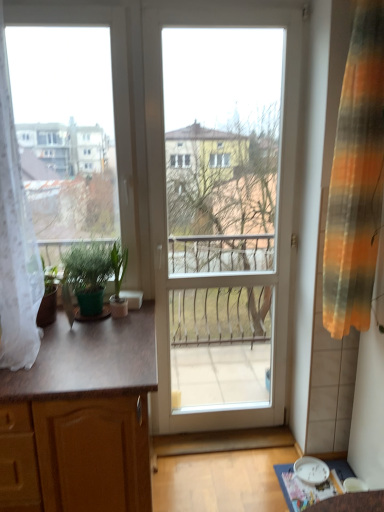
Question: Can you confirm if wooden cabinet at left is taller than green matte plant at left, positioned as the second houseplant in left-to-right order?

Choices:
 (A) no
 (B) yes

Answer: (B)

Question: From the image's perspective, does wooden cabinet at left appear higher than green matte plant at left, positioned as the second houseplant in left-to-right order?

Choices:
 (A) no
 (B) yes

Answer: (A)

Question: Does wooden cabinet at left appear on the left side of green matte plant at left, positioned as the second houseplant in left-to-right order?

Choices:
 (A) yes
 (B) no

Answer: (A)

Question: Does wooden cabinet at left come behind green matte plant at left, which is the 1th houseplant in right-to-left order?

Choices:
 (A) no
 (B) yes

Answer: (A)

Question: Is green matte plant at left, which is the 1th houseplant in right-to-left order, at the back of wooden cabinet at left?

Choices:
 (A) no
 (B) yes

Answer: (A)

Question: Does point (117, 266) appear closer or farther from the camera than point (86, 287)?

Choices:
 (A) farther
 (B) closer

Answer: (A)

Question: Is green matte plant at left, positioned as the second houseplant in left-to-right order, wider or thinner than green matte plant at left, which is the 1th houseplant in left-to-right order?

Choices:
 (A) thin
 (B) wide

Answer: (A)

Question: From a real-world perspective, is green matte plant at left, which is the 1th houseplant in right-to-left order, physically located above or below green matte plant at left, which is the 1th houseplant in left-to-right order?

Choices:
 (A) below
 (B) above

Answer: (A)

Question: From the image's perspective, relative to green matte plant at left, which is the 1th houseplant in left-to-right order, is green matte plant at left, positioned as the second houseplant in left-to-right order, above or below?

Choices:
 (A) below
 (B) above

Answer: (A)

Question: In the image, is white glossy door at center on the left side or the right side of white lace curtain at left, which is counted as the 1th curtain, starting from the left?

Choices:
 (A) left
 (B) right

Answer: (B)

Question: From a real-world perspective, is white glossy door at center physically located above or below white lace curtain at left, acting as the second curtain starting from the right?

Choices:
 (A) above
 (B) below

Answer: (B)

Question: Considering their positions, is white glossy door at center located in front of or behind white lace curtain at left, which is counted as the 1th curtain, starting from the left?

Choices:
 (A) behind
 (B) front

Answer: (A)

Question: Is point (274, 423) closer or farther from the camera than point (16, 364)?

Choices:
 (A) closer
 (B) farther

Answer: (B)

Question: Looking at the image, does green matte plant at left, which is the 1th houseplant in left-to-right order, seem bigger or smaller compared to green matte plant at left, positioned as the second houseplant in left-to-right order?

Choices:
 (A) small
 (B) big

Answer: (B)

Question: Would you say green matte plant at left, which is the 1th houseplant in left-to-right order, is inside or outside green matte plant at left, which is the 1th houseplant in right-to-left order?

Choices:
 (A) outside
 (B) inside

Answer: (A)